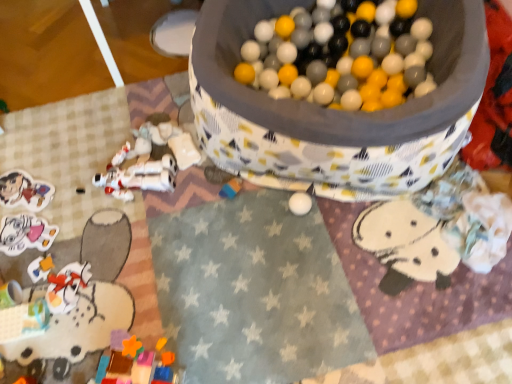
Image resolution: width=512 pixels, height=384 pixels. What are the coordinates of `free space to the right of plastic toy figure at lower left, placed as the fourth toy when sorted from right to left` in the screenshot? It's located at (115, 281).